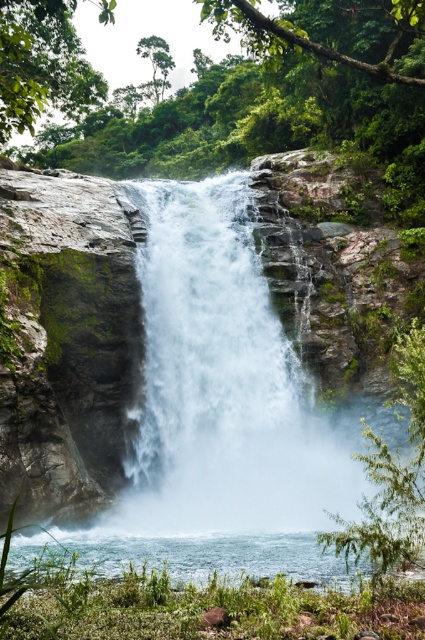
Describe the element at coordinates (173, 387) in the screenshot. This screenshot has width=425, height=640. I see `white misty water at center` at that location.

Can you confirm if white misty water at center is bigger than clear water at lower center?

Indeed, white misty water at center has a larger size compared to clear water at lower center.

Which is in front, point (50, 237) or point (271, 570)?

Point (271, 570)

Locate an element on the screen. This screenshot has height=640, width=425. white misty water at center is located at coordinates (173, 387).